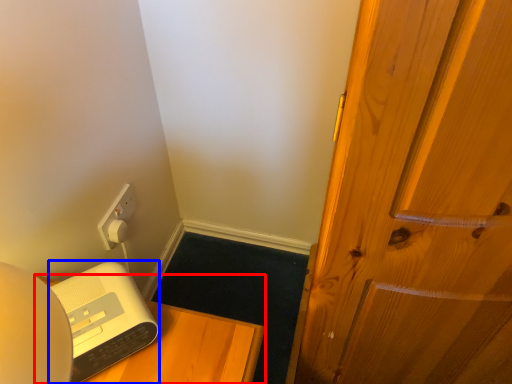
Question: Which object is closer to the camera taking this photo, furniture (highlighted by a red box) or appliance (highlighted by a blue box)?

Choices:
 (A) furniture
 (B) appliance

Answer: (B)